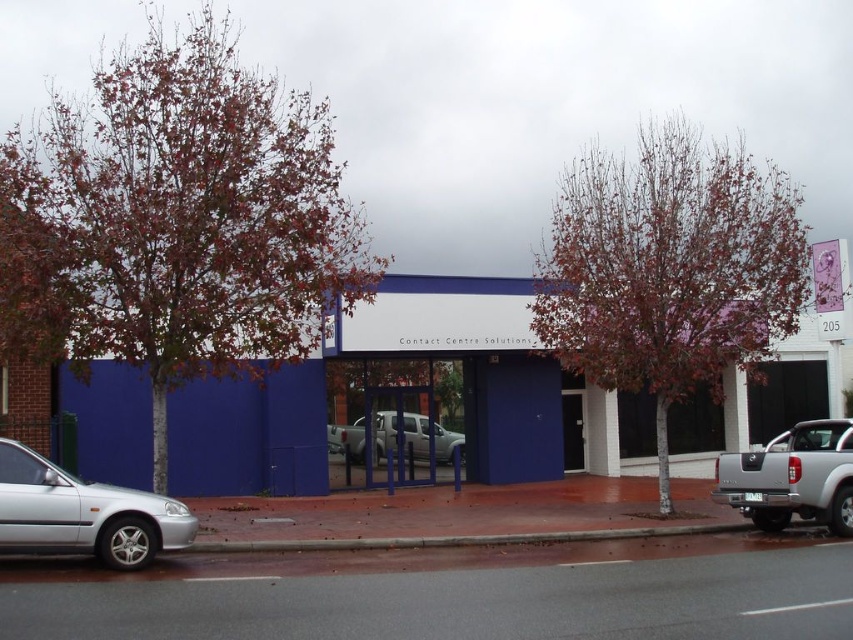
Question: Which of the following is the closest to the observer?

Choices:
 (A) silver metallic pickup truck at right
 (B) brown leafy tree at center

Answer: (A)

Question: Among these objects, which one is nearest to the camera?

Choices:
 (A) brown leafy tree at center
 (B) silver metallic pickup truck at right

Answer: (B)

Question: Which of the following is the closest to the observer?

Choices:
 (A) (763, 246)
 (B) (735, 493)

Answer: (B)

Question: Does brown concrete curb at lower center appear under silver metallic pickup truck at center?

Choices:
 (A) no
 (B) yes

Answer: (B)

Question: Is brown leafy tree at center to the right of silver metallic car at lower left from the viewer's perspective?

Choices:
 (A) yes
 (B) no

Answer: (A)

Question: Is silver metallic pickup truck at right below brown concrete curb at lower center?

Choices:
 (A) no
 (B) yes

Answer: (A)